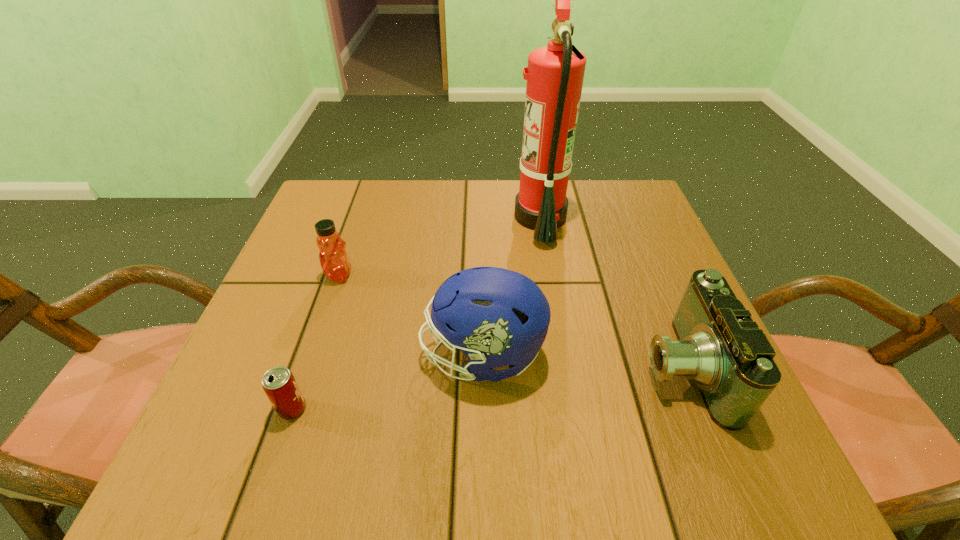
Identify the location of free space located on the face guard of the fourth shortest object. (244, 355).

Identify the location of free space located 0.250m on the face guard of the fourth shortest object. (282, 355).

Where is `blank area located 0.400m on the front-facing side of the rightmost object`? Image resolution: width=960 pixels, height=540 pixels. blank area located 0.400m on the front-facing side of the rightmost object is located at coordinates (415, 367).

Image resolution: width=960 pixels, height=540 pixels. What are the coordinates of `vacant region located 0.250m on the front-facing side of the rightmost object` in the screenshot? It's located at (499, 367).

The width and height of the screenshot is (960, 540). Find the location of `vacant space located on the front-facing side of the rightmost object`. vacant space located on the front-facing side of the rightmost object is located at coordinates (557, 367).

At what (x,y) coordinates should I click in order to perform the action: click on vacant space positioned on the front label of the honey. Please return your answer as a coordinate pair (x, y). This screenshot has height=540, width=960. Looking at the image, I should click on (414, 275).

Find the location of `vacant space located on the right of the shortest object`. vacant space located on the right of the shortest object is located at coordinates (442, 409).

Locate an element on the screen. object located in the far edge section of the desktop is located at coordinates (555, 73).

Locate an element on the screen. Image resolution: width=960 pixels, height=540 pixels. object at the near edge is located at coordinates (719, 347).

At what (x,y) coordinates should I click in order to perform the action: click on honey that is at the left edge. Please return your answer as a coordinate pair (x, y). The image size is (960, 540). Looking at the image, I should click on (333, 257).